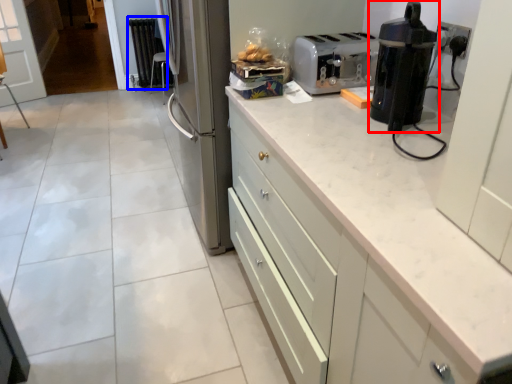
Question: Which point is further to the camera, home appliance (highlighted by a red box) or radiator (highlighted by a blue box)?

Choices:
 (A) home appliance
 (B) radiator

Answer: (B)